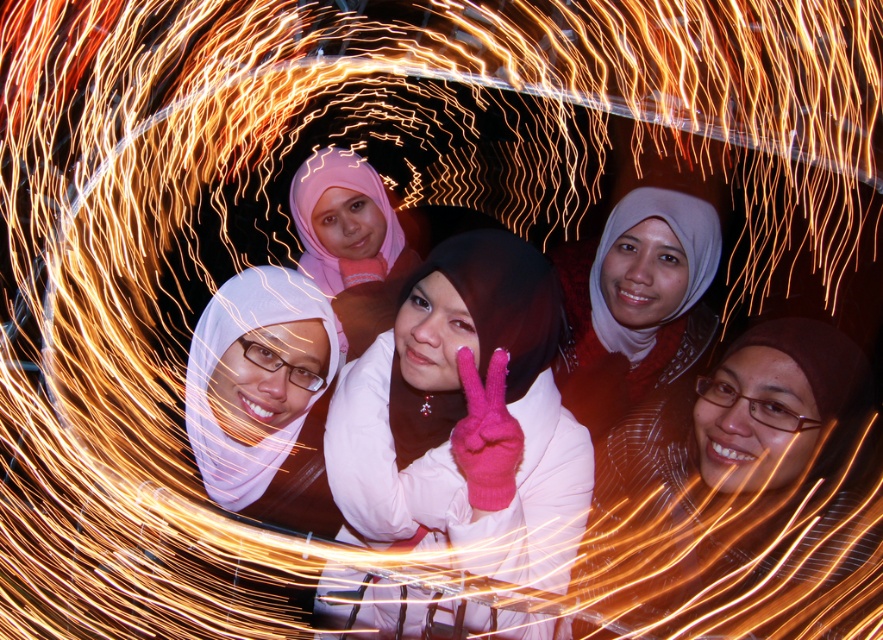
Question: Among these objects, which one is farthest from the camera?

Choices:
 (A) pink fabric hijab at center
 (B) matte white hijab at center
 (C) pink woolen gloves at center

Answer: (B)

Question: Does pink fabric hijab at center appear under matte white hijab at center?

Choices:
 (A) no
 (B) yes

Answer: (B)

Question: Which point is farther to the camera?

Choices:
 (A) pink woolen gloves at center
 (B) pink fabric hijab at center
 (C) matte white hijab at center

Answer: (C)

Question: Estimate the real-world distances between objects in this image. Which object is farther from the pink fabric hijab at center?

Choices:
 (A) matte white hijab at center
 (B) pink woolen gloves at center

Answer: (A)

Question: Does pink woolen gloves at center appear under pink fabric hijab at center?

Choices:
 (A) yes
 (B) no

Answer: (B)

Question: Does pink woolen gloves at center appear on the right side of matte white hijab at center?

Choices:
 (A) yes
 (B) no

Answer: (B)